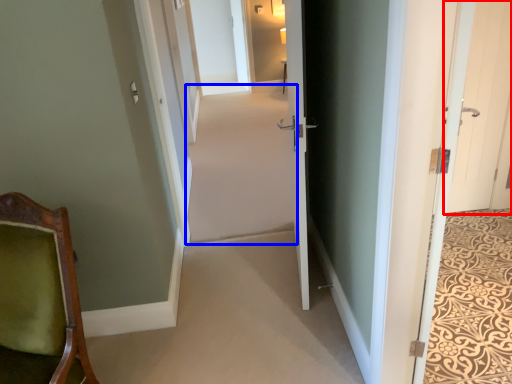
Question: Which point is closer to the camera, door (highlighted by a red box) or plain (highlighted by a blue box)?

Choices:
 (A) door
 (B) plain

Answer: (B)